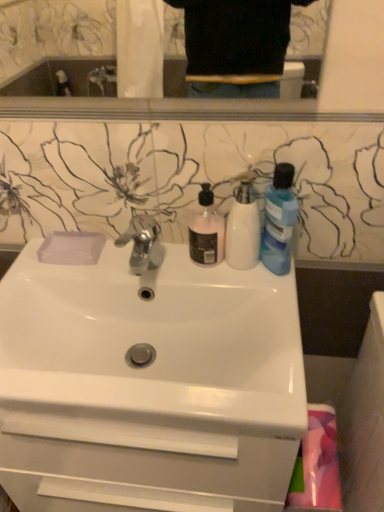
Question: Should I look upward or downward to see pink matte liquid soap at center, which is the 3th cleaning product from right to left?

Choices:
 (A) up
 (B) down

Answer: (A)

Question: Does polished chrome faucet at center have a greater width compared to white glossy sink at center?

Choices:
 (A) no
 (B) yes

Answer: (A)

Question: From the image's perspective, is polished chrome faucet at center located beneath white glossy sink at center?

Choices:
 (A) yes
 (B) no

Answer: (B)

Question: Are polished chrome faucet at center and white glossy sink at center beside each other?

Choices:
 (A) yes
 (B) no

Answer: (B)

Question: Does polished chrome faucet at center appear on the left side of white glossy sink at center?

Choices:
 (A) yes
 (B) no

Answer: (A)

Question: From a real-world perspective, is polished chrome faucet at center located higher than white glossy sink at center?

Choices:
 (A) yes
 (B) no

Answer: (A)

Question: Does polished chrome faucet at center have a greater height compared to white glossy sink at center?

Choices:
 (A) no
 (B) yes

Answer: (A)

Question: From the image's perspective, does pink fabric at lower right appear higher than white matte bottle at center, marked as the 2th cleaning product in a left-to-right arrangement?

Choices:
 (A) yes
 (B) no

Answer: (B)

Question: Could white matte bottle at center, marked as the 2th cleaning product in a left-to-right arrangement, be considered to be inside pink fabric at lower right?

Choices:
 (A) no
 (B) yes

Answer: (A)

Question: From the image's perspective, is pink fabric at lower right under white matte bottle at center, marked as the 2th cleaning product in a left-to-right arrangement?

Choices:
 (A) yes
 (B) no

Answer: (A)

Question: Considering the relative sizes of pink fabric at lower right and white matte bottle at center, marked as the 2th cleaning product in a left-to-right arrangement, in the image provided, is pink fabric at lower right smaller than white matte bottle at center, marked as the 2th cleaning product in a left-to-right arrangement,?

Choices:
 (A) no
 (B) yes

Answer: (A)

Question: From a real-world perspective, is pink fabric at lower right on white matte bottle at center, marked as the second cleaning product in a right-to-left arrangement?

Choices:
 (A) yes
 (B) no

Answer: (B)

Question: Is pink fabric at lower right to the left of white matte bottle at center, marked as the 2th cleaning product in a left-to-right arrangement, from the viewer's perspective?

Choices:
 (A) yes
 (B) no

Answer: (B)

Question: Is the depth of pink matte liquid soap at center, which is the 3th cleaning product from right to left, greater than that of white matte bottle at center, marked as the second cleaning product in a right-to-left arrangement?

Choices:
 (A) yes
 (B) no

Answer: (A)